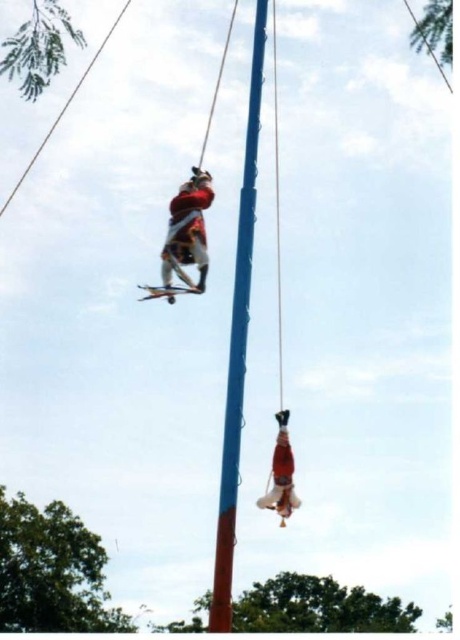
Which is in front, point (247, 113) or point (282, 440)?

Point (282, 440) is more forward.

Does blue painted wood pole at center have a greater height compared to red fabric person at lower center?

Yes, blue painted wood pole at center is taller than red fabric person at lower center.

Image resolution: width=460 pixels, height=640 pixels. What do you see at coordinates (237, 346) in the screenshot? I see `blue painted wood pole at center` at bounding box center [237, 346].

This screenshot has width=460, height=640. I want to click on blue painted wood pole at center, so click(237, 346).

Is blue painted wood pole at center above red fabric person at upper center?

Indeed, blue painted wood pole at center is positioned over red fabric person at upper center.

Who is positioned more to the right, blue painted wood pole at center or red fabric person at upper center?

From the viewer's perspective, blue painted wood pole at center appears more on the right side.

Is point (253, 195) in front of point (191, 227)?

No, it is not.

Identify the location of blue painted wood pole at center. (237, 346).

Who is positioned more to the right, red fabric person at upper center or red fabric person at lower center?

Positioned to the right is red fabric person at lower center.

Measure the distance between point [178,264] and camera.

The distance of point [178,264] from camera is 23.05 meters.

Is point (202, 182) more distant than point (279, 492)?

That is True.

At what (x,y) coordinates should I click in order to perform the action: click on red fabric person at upper center. Please return your answer as a coordinate pair (x, y). Image resolution: width=460 pixels, height=640 pixels. Looking at the image, I should click on (188, 230).